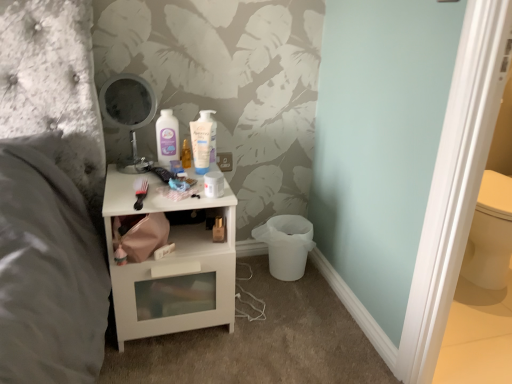
Where is `vacant area in front of metallic round mirror at upper center`? The height and width of the screenshot is (384, 512). vacant area in front of metallic round mirror at upper center is located at coordinates (132, 187).